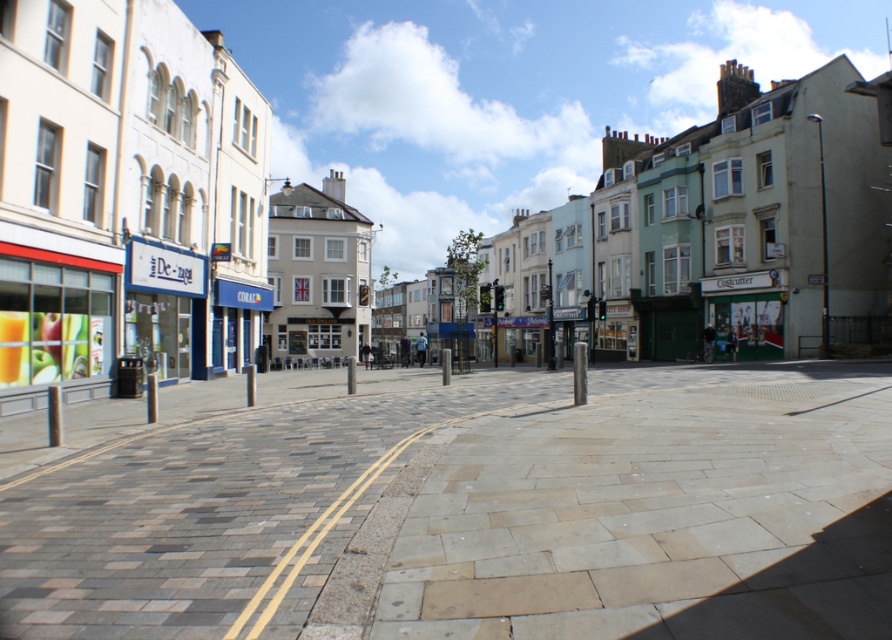
Question: Which point is closer to the camera?

Choices:
 (A) matte white building at center
 (B) paved stone pavement at center

Answer: (B)

Question: Among these objects, which one is nearest to the camera?

Choices:
 (A) matte white building at center
 (B) paved stone pavement at center

Answer: (B)

Question: Is paved stone pavement at center thinner than matte white building at center?

Choices:
 (A) yes
 (B) no

Answer: (A)

Question: Is paved stone pavement at center below matte white building at center?

Choices:
 (A) yes
 (B) no

Answer: (A)

Question: Does paved stone pavement at center have a greater width compared to matte white building at center?

Choices:
 (A) yes
 (B) no

Answer: (B)